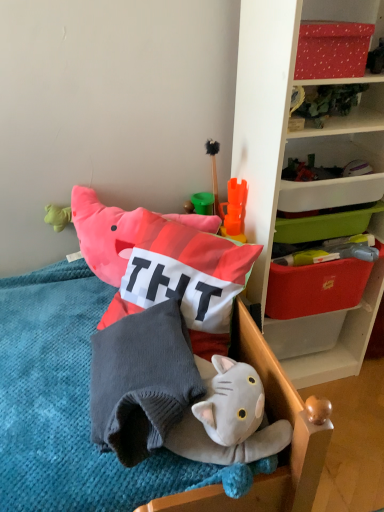
Question: Can you confirm if red plastic storage box at upper right, which is counted as the 3th storage box, starting from the top, is positioned to the left of soft cotton pillow at center?

Choices:
 (A) yes
 (B) no

Answer: (B)

Question: Is red plastic storage box at upper right, which is counted as the 3th storage box, starting from the top, next to soft cotton pillow at center and touching it?

Choices:
 (A) no
 (B) yes

Answer: (A)

Question: Could you tell me if red plastic storage box at upper right, which is counted as the 3th storage box, starting from the top, is facing soft cotton pillow at center?

Choices:
 (A) no
 (B) yes

Answer: (A)

Question: From the image's perspective, does red plastic storage box at upper right, which is counted as the 3th storage box, starting from the top, appear higher than soft cotton pillow at center?

Choices:
 (A) no
 (B) yes

Answer: (B)

Question: Can you confirm if red plastic storage box at upper right, which appears as the first storage box when ordered from the bottom, is shorter than soft cotton pillow at center?

Choices:
 (A) no
 (B) yes

Answer: (B)

Question: Is red plastic storage box at upper right, which is counted as the 3th storage box, starting from the top, positioned before soft cotton pillow at center?

Choices:
 (A) no
 (B) yes

Answer: (A)

Question: Is orange plastic storage box at upper right, which is the second storage box from top to bottom, oriented away from white plastic shelf at upper right?

Choices:
 (A) yes
 (B) no

Answer: (A)

Question: Considering the relative positions of orange plastic storage box at upper right, acting as the second storage box starting from the bottom, and white plastic shelf at upper right in the image provided, is orange plastic storage box at upper right, acting as the second storage box starting from the bottom, to the right of white plastic shelf at upper right from the viewer's perspective?

Choices:
 (A) no
 (B) yes

Answer: (A)

Question: Is orange plastic storage box at upper right, acting as the second storage box starting from the bottom, located outside white plastic shelf at upper right?

Choices:
 (A) no
 (B) yes

Answer: (A)

Question: Does orange plastic storage box at upper right, which is the second storage box from top to bottom, touch white plastic shelf at upper right?

Choices:
 (A) no
 (B) yes

Answer: (A)

Question: Considering the relative positions of orange plastic storage box at upper right, acting as the second storage box starting from the bottom, and white plastic shelf at upper right in the image provided, is orange plastic storage box at upper right, acting as the second storage box starting from the bottom, behind white plastic shelf at upper right?

Choices:
 (A) no
 (B) yes

Answer: (B)

Question: Considering the relative sizes of orange plastic storage box at upper right, which is the second storage box from top to bottom, and white plastic shelf at upper right in the image provided, is orange plastic storage box at upper right, which is the second storage box from top to bottom, shorter than white plastic shelf at upper right?

Choices:
 (A) yes
 (B) no

Answer: (A)

Question: Is red dotted fabric at upper right, which is the 3th storage box from bottom to top, thinner than gray knitted pillow at center?

Choices:
 (A) no
 (B) yes

Answer: (B)